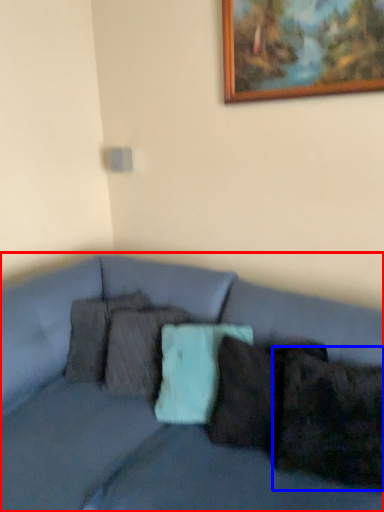
Question: Which object is further to the camera taking this photo, studio couch (highlighted by a red box) or pillow (highlighted by a blue box)?

Choices:
 (A) studio couch
 (B) pillow

Answer: (B)